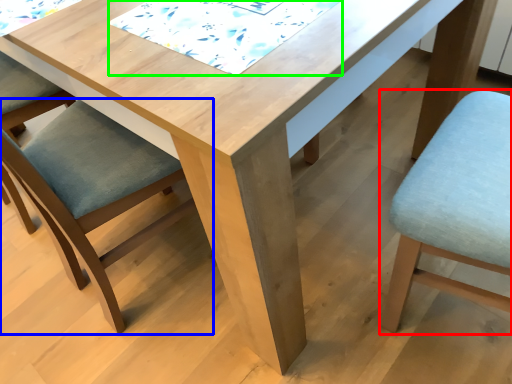
Question: Which is nearer to the chair (highlighted by a red box)? chair (highlighted by a blue box) or quilt (highlighted by a green box).

Choices:
 (A) chair
 (B) quilt

Answer: (B)